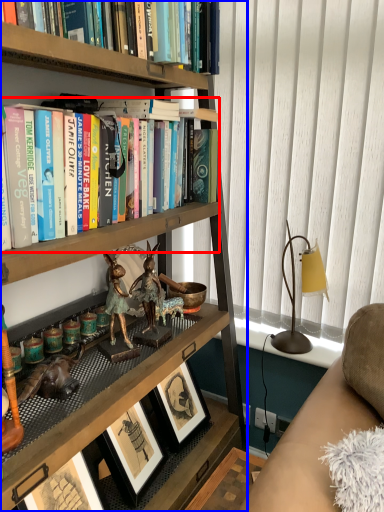
Question: Among these objects, which one is farthest to the camera, book (highlighted by a red box) or bookcase (highlighted by a blue box)?

Choices:
 (A) book
 (B) bookcase

Answer: (A)